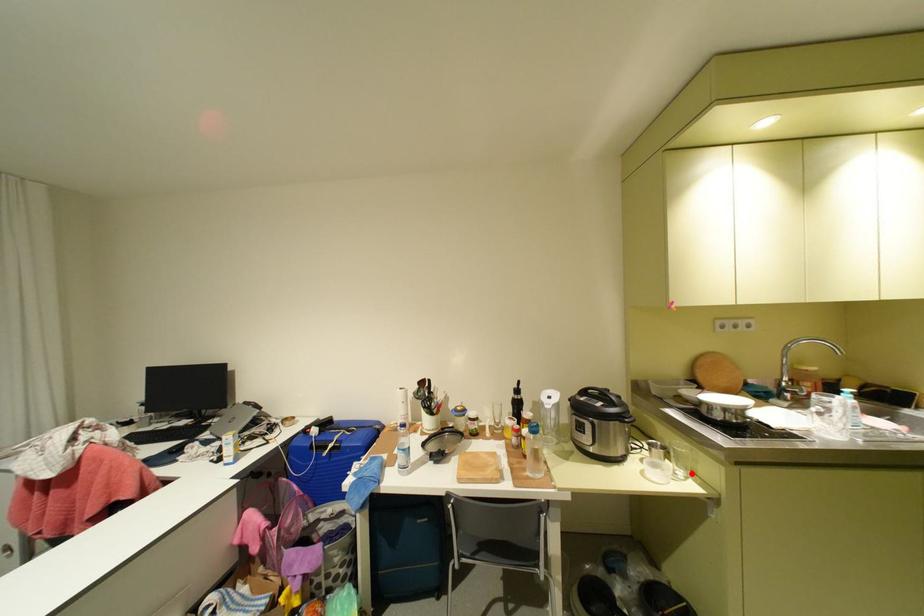
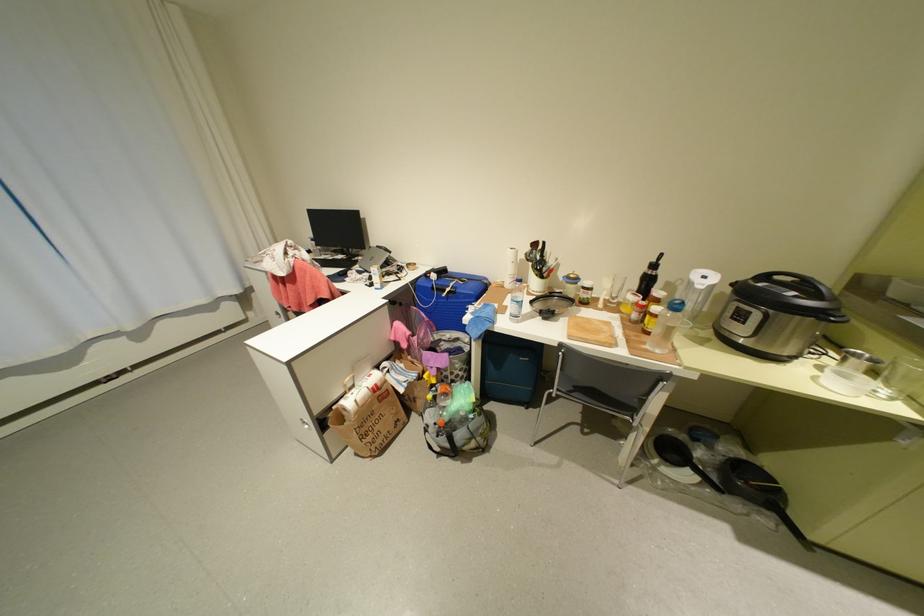
Locate, in the second image, the point that corresponds to the highlighted location in the first image.

(897, 392)